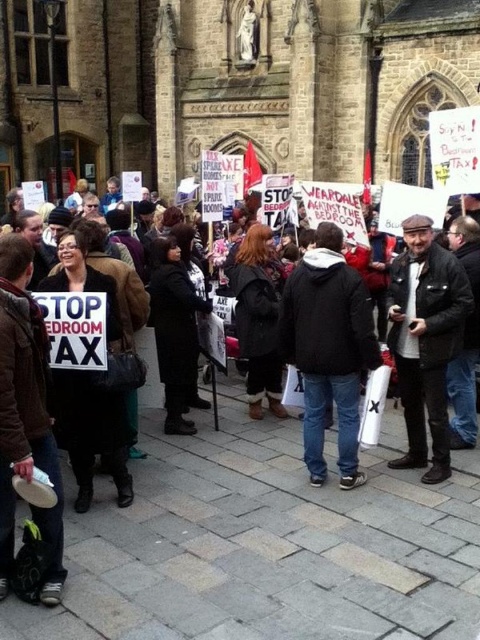
You are a photographer standing at the edge of the protest crowd. You need to capture a photo that includes both the black leather jacket at center and the black leather coat at center. If your camera has a maximum focus range of 8 meters, will you be able to include both in the same frame without moving closer?

The distance between the black leather jacket at center and the black leather coat at center is 7.87 meters, which is within the camera maximum focus range of 8 meters. Therefore, you can capture both in the same frame without moving closer.

You are a photographer trying to capture a clear shot of both the dark blue jeans at center and the leather jacket at center. Since you want to ensure both are visible in the frame, which object should you position closer to the left side of your camera viewfinder?

The dark blue jeans at center is to the left of the leather jacket at center, so to capture both in the frame, position the dark blue jeans at center closer to the left side of the camera viewfinder.

You are a photographer trying to capture a clear shot of both the dark blue jeans at center and the leather jacket at center in the protest scene. Since you want to ensure both are visible, which object should you focus on first considering their sizes?

The dark blue jeans at center is larger in size than the leather jacket at center, so you should focus on the dark blue jeans at center first to ensure it is in clear focus before adjusting for the smaller leather jacket at center.